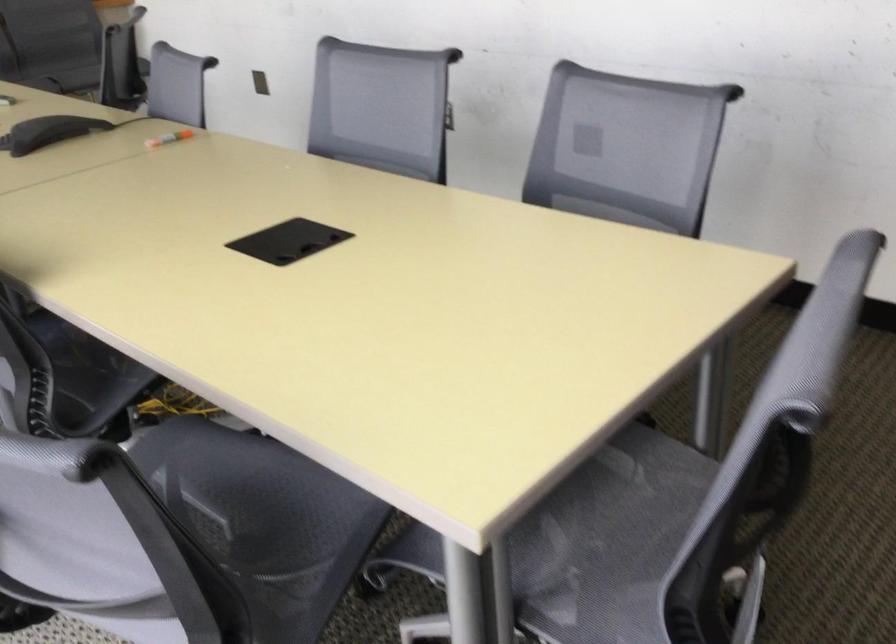
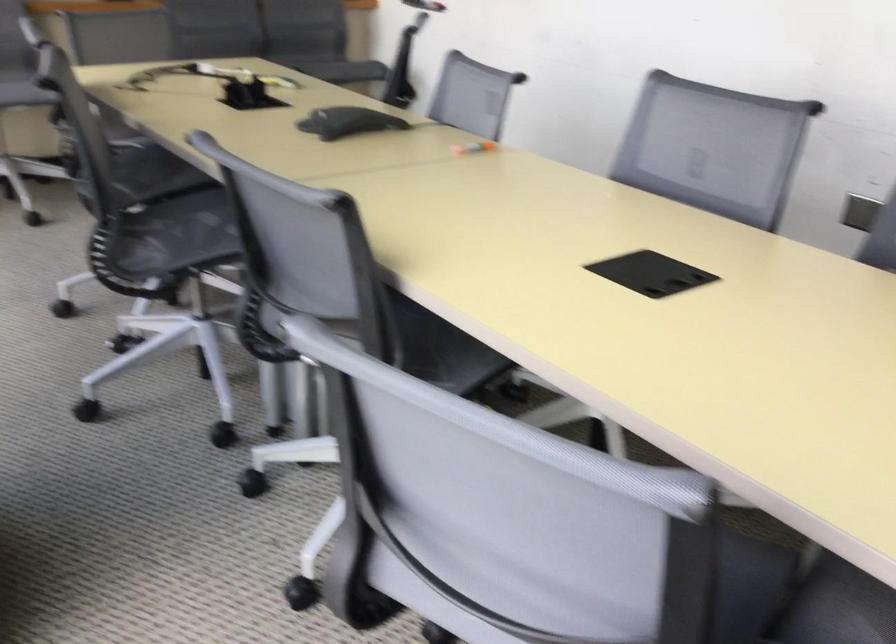
Where in the second image is the point corresponding to pixel 536 176 from the first image?

(879, 241)